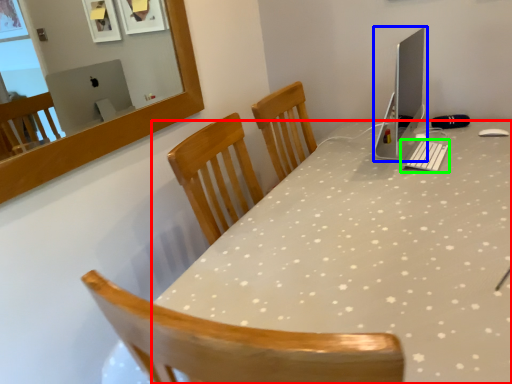
Question: Which is nearer to the desk (highlighted by a red box)? computer monitor (highlighted by a blue box) or keyboard (highlighted by a green box).

Choices:
 (A) computer monitor
 (B) keyboard

Answer: (B)